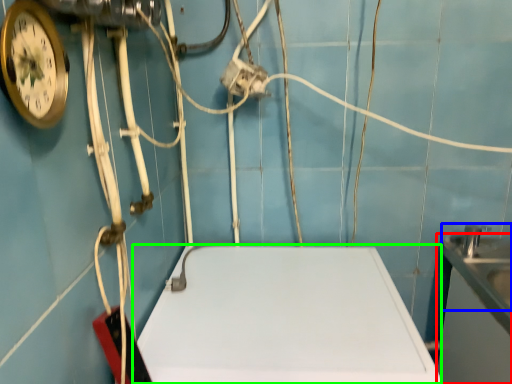
Question: Which object is the closest to the counter top (highlighted by a red box)? Choose among these: sink (highlighted by a blue box) or counter top (highlighted by a green box).

Choices:
 (A) sink
 (B) counter top

Answer: (A)